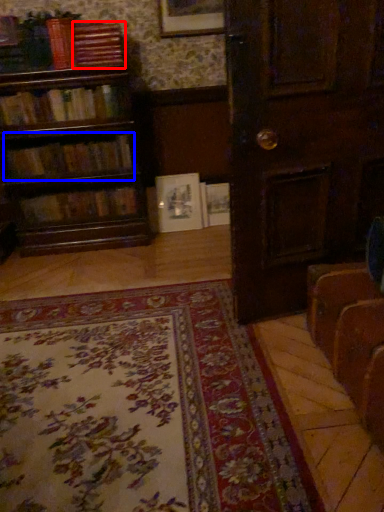
Question: Among these objects, which one is nearest to the camera, book (highlighted by a red box) or book (highlighted by a blue box)?

Choices:
 (A) book
 (B) book

Answer: (A)